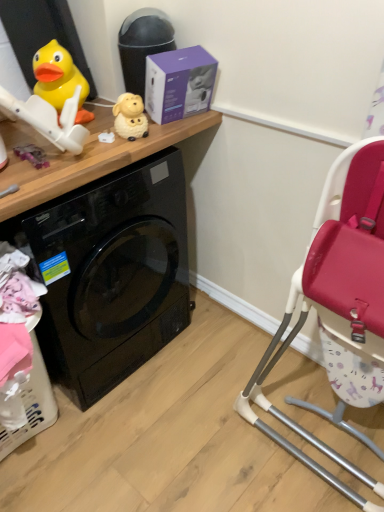
Question: Would you say purple fabric toy at left, the 3th toy from the right, is outside purple matte box at upper center?

Choices:
 (A) yes
 (B) no

Answer: (A)

Question: Is purple fabric toy at left, the 3th toy from the right, oriented away from purple matte box at upper center?

Choices:
 (A) yes
 (B) no

Answer: (B)

Question: Considering the relative positions of purple fabric toy at left, the 3th toy from the right, and purple matte box at upper center in the image provided, is purple fabric toy at left, the 3th toy from the right, in front of purple matte box at upper center?

Choices:
 (A) no
 (B) yes

Answer: (B)

Question: Does purple fabric toy at left, which is the 1th toy in left-to-right order, touch purple matte box at upper center?

Choices:
 (A) no
 (B) yes

Answer: (A)

Question: Is purple fabric toy at left, which is the 1th toy in left-to-right order, not near purple matte box at upper center?

Choices:
 (A) no
 (B) yes

Answer: (A)

Question: From the image's perspective, is purple fabric toy at left, the 3th toy from the right, above or below rubber duck at upper left, which ranks as the 2th toy in left-to-right order?

Choices:
 (A) below
 (B) above

Answer: (A)

Question: Considering the positions of purple fabric toy at left, which is the 1th toy in left-to-right order, and rubber duck at upper left, which ranks as the 2th toy in left-to-right order, in the image, is purple fabric toy at left, which is the 1th toy in left-to-right order, bigger or smaller than rubber duck at upper left, which ranks as the 2th toy in left-to-right order,?

Choices:
 (A) big
 (B) small

Answer: (B)

Question: Is purple fabric toy at left, the 3th toy from the right, in front of or behind rubber duck at upper left, which ranks as the 2th toy in left-to-right order, in the image?

Choices:
 (A) behind
 (B) front

Answer: (B)

Question: In terms of width, does purple fabric toy at left, which is the 1th toy in left-to-right order, look wider or thinner when compared to rubber duck at upper left, which ranks as the 2th toy in left-to-right order?

Choices:
 (A) thin
 (B) wide

Answer: (A)

Question: Choose the correct answer: Is purple matte box at upper center inside white glossy sheep at upper center, the first toy positioned from the right, or outside it?

Choices:
 (A) inside
 (B) outside

Answer: (B)

Question: From the image's perspective, is purple matte box at upper center above or below white glossy sheep at upper center, the third toy viewed from the left?

Choices:
 (A) above
 (B) below

Answer: (A)

Question: Based on their sizes in the image, would you say purple matte box at upper center is bigger or smaller than white glossy sheep at upper center, the third toy viewed from the left?

Choices:
 (A) small
 (B) big

Answer: (B)

Question: In the image, is purple matte box at upper center positioned in front of or behind white glossy sheep at upper center, the first toy positioned from the right?

Choices:
 (A) front
 (B) behind

Answer: (A)

Question: In the image, is purple matte box at upper center on the left side or the right side of black glossy washing machine at left?

Choices:
 (A) left
 (B) right

Answer: (B)

Question: Relative to black glossy washing machine at left, is purple matte box at upper center in front or behind?

Choices:
 (A) behind
 (B) front

Answer: (A)